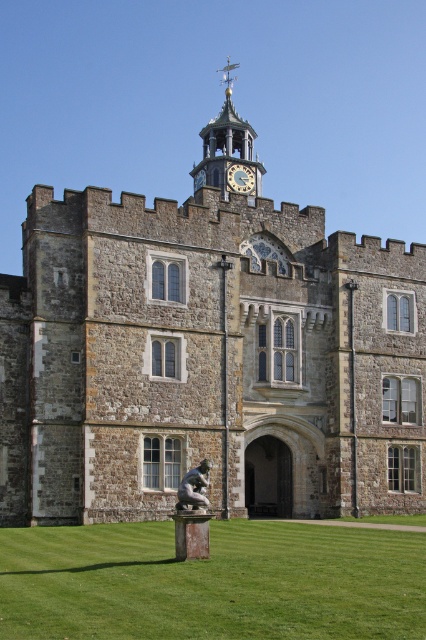
You are standing in front of the grand stone building and want to take a photo of both the stone clock tower at upper center and the gold metallic clock at upper center. Which object should you focus on first to ensure both are in the frame?

You should focus on the stone clock tower at upper center first because it is closer to you than the gold metallic clock at upper center, ensuring both are in the frame.

Based on the photo, you are an architect reviewing the design of a building. You notice the brown stone castle at center and the gold metallic clock at upper center. Which object is closer to the viewer?

The brown stone castle at center is closer to the viewer as it is in front of the gold metallic clock at upper center.

You are a gardener planning to plant flowers along the edge of the green grass at lower center and the bronze statue at center. Which area requires more flowers if you want to cover the entire width of each area?

The green grass at lower center requires more flowers because its width is greater than the bronze statue at center.